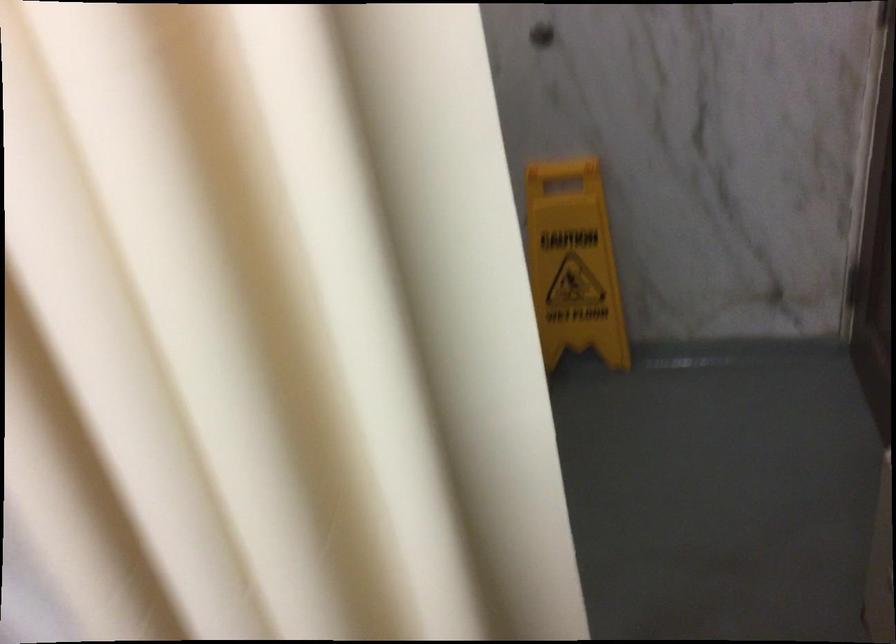
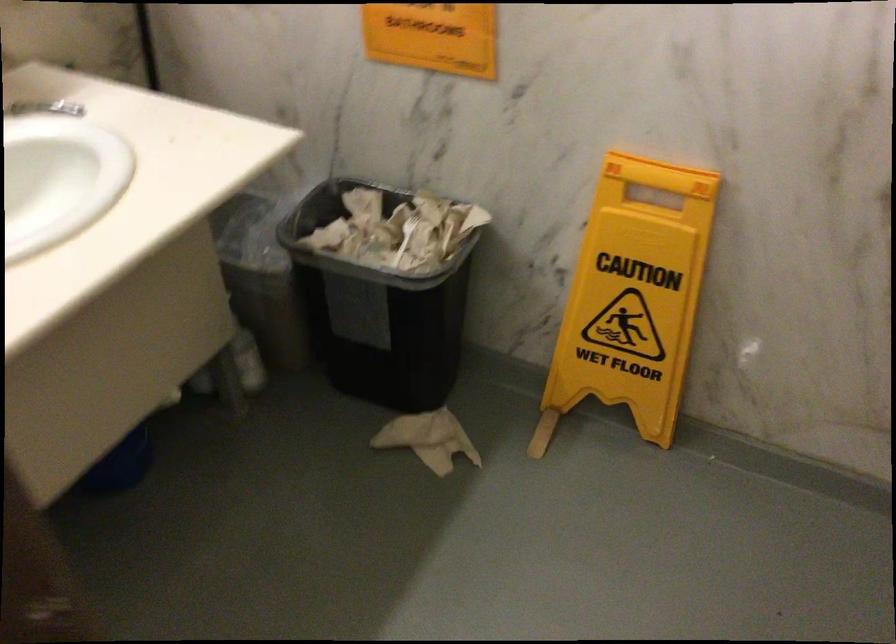
Locate, in the second image, the point that corresponds to (x=565, y=171) in the first image.

(659, 175)